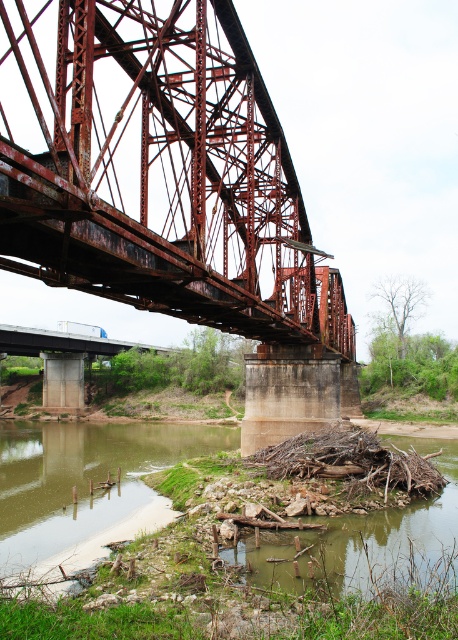
Between rusty metal bridge at center and green mossy riverbank at lower left, which one has less height?

Standing shorter between the two is green mossy riverbank at lower left.

Is rusty metal bridge at center smaller than green mossy riverbank at lower left?

No, rusty metal bridge at center is not smaller than green mossy riverbank at lower left.

Which is in front, point (154, 42) or point (140, 451)?

Point (154, 42)

Locate an element on the screen. rusty metal bridge at center is located at coordinates (170, 189).

Is rusty metal bridge at center wider than brown muddy river at lower center?

Yes.

Which is above, rusty metal bridge at center or brown muddy river at lower center?

Positioned higher is rusty metal bridge at center.

The image size is (458, 640). I want to click on rusty metal bridge at center, so click(170, 189).

Where is `rusty metal bridge at center`? This screenshot has height=640, width=458. rusty metal bridge at center is located at coordinates (170, 189).

Can you confirm if green mossy riverbank at lower left is positioned above brown muddy river at lower center?

Result: No.

Which of these two, green mossy riverbank at lower left or brown muddy river at lower center, stands shorter?

With less height is brown muddy river at lower center.

The image size is (458, 640). I want to click on green mossy riverbank at lower left, so click(x=86, y=488).